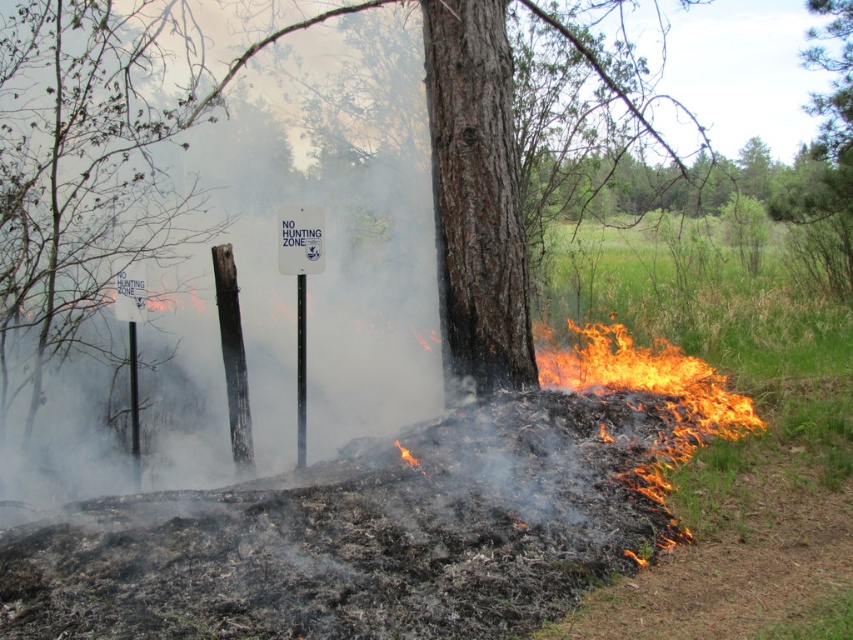
Consider the image. Who is more forward, (666,346) or (132,340)?

Point (132,340) is more forward.

Image resolution: width=853 pixels, height=640 pixels. What do you see at coordinates (648, 380) in the screenshot? I see `flame at lower right` at bounding box center [648, 380].

Locate an element on the screen. The width and height of the screenshot is (853, 640). flame at lower right is located at coordinates click(648, 380).

Where is `flame at lower right`? Image resolution: width=853 pixels, height=640 pixels. flame at lower right is located at coordinates (648, 380).

Describe the element at coordinates (132, 403) in the screenshot. The width and height of the screenshot is (853, 640). I see `smooth wooden pole at center` at that location.

Does smooth wooden pole at center lie in front of flame at lower center?

No, it is behind flame at lower center.

This screenshot has height=640, width=853. I want to click on smooth wooden pole at center, so click(x=132, y=403).

Locate an element on the screen. charcoal textured post at center is located at coordinates (233, 356).

Where is `charcoal textured post at center`? The image size is (853, 640). charcoal textured post at center is located at coordinates (233, 356).